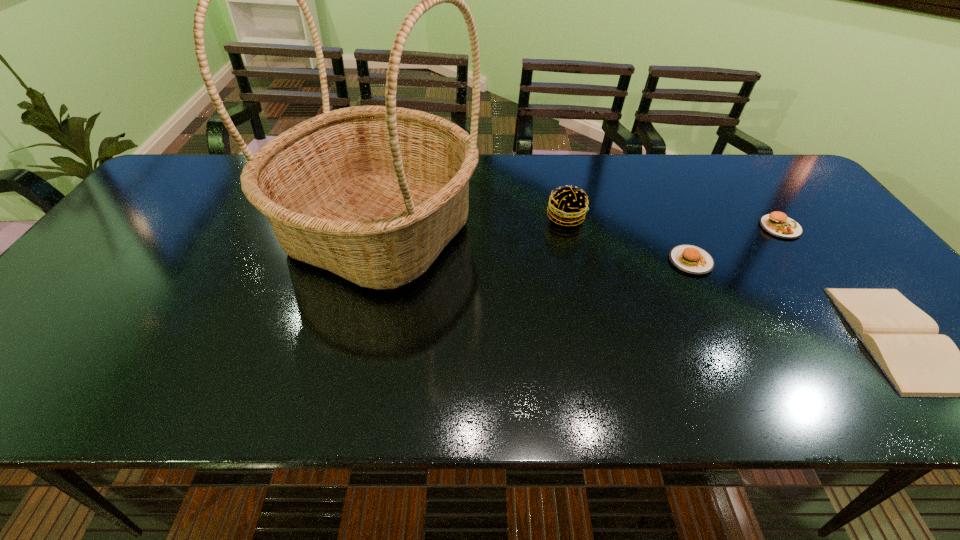
Locate an element on the screen. the tallest object is located at coordinates (373, 194).

Image resolution: width=960 pixels, height=540 pixels. Identify the location of the leftmost object. (373, 194).

This screenshot has height=540, width=960. In order to click on the leftmost food in this screenshot , I will do `click(568, 205)`.

This screenshot has width=960, height=540. I want to click on the second object from left to right, so click(x=568, y=205).

Identify the location of the rightmost food. The image size is (960, 540). (778, 224).

Where is `the third object from right to left`? Image resolution: width=960 pixels, height=540 pixels. the third object from right to left is located at coordinates (690, 259).

Locate an element on the screen. This screenshot has height=540, width=960. the nearest food is located at coordinates (690, 259).

This screenshot has width=960, height=540. What are the coordinates of `vacant region located 0.170m on the left of the tallest object` in the screenshot? It's located at [x=214, y=231].

I want to click on vacant space located on the left of the fourth shortest object, so click(x=525, y=217).

Locate an element on the screen. This screenshot has width=960, height=540. vacant space located 0.210m on the front of the rightmost food is located at coordinates (834, 300).